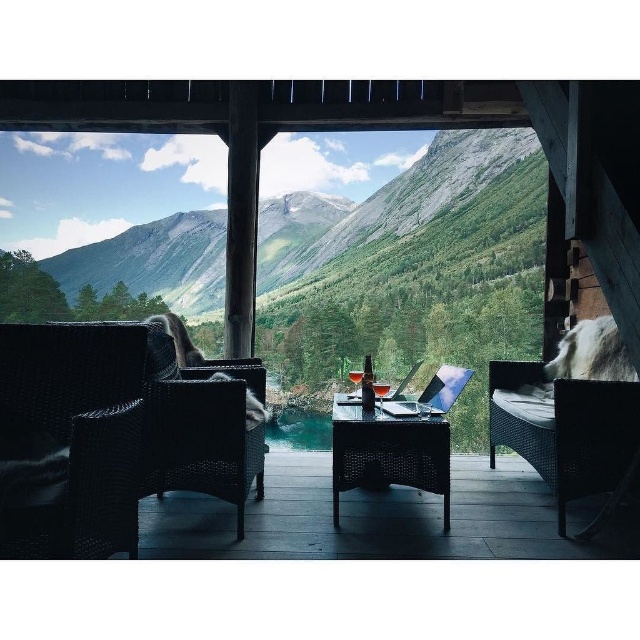
Can you confirm if woven rattan armchair at right is wider than woven rattan armchair at left?

Answer: Incorrect, woven rattan armchair at right's width does not surpass woven rattan armchair at left's.

Measure the distance between point [518,369] and camera.

A distance of 11.76 feet exists between point [518,369] and camera.

Does point (499, 422) come behind point (221, 465)?

Yes.

I want to click on woven rattan armchair at right, so pyautogui.click(x=564, y=429).

Can you confirm if woven dark brown armchair at left is thinner than woven rattan armchair at right?

Incorrect, woven dark brown armchair at left's width is not less than woven rattan armchair at right's.

Does woven dark brown armchair at left come in front of woven rattan armchair at right?

That is True.

Which is in front, point (90, 429) or point (545, 396)?

Point (90, 429) is in front.

The height and width of the screenshot is (640, 640). What are the coordinates of `woven dark brown armchair at left` in the screenshot? It's located at (74, 436).

Is woven rattan armchair at left shorter than rattan table at center?

No.

Is woven rattan armchair at left thinner than rattan table at center?

Yes.

Who is more distant from viewer, [211,376] or [408,467]?

The point [211,376] is behind.

This screenshot has height=640, width=640. I want to click on woven rattan armchair at left, so point(205,440).